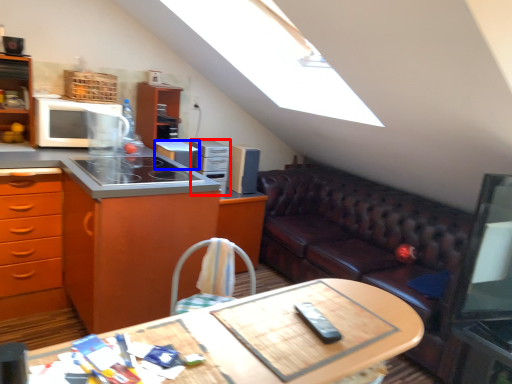
Question: Which point is further to the camera, appliance (highlighted by a red box) or appliance (highlighted by a blue box)?

Choices:
 (A) appliance
 (B) appliance

Answer: (A)